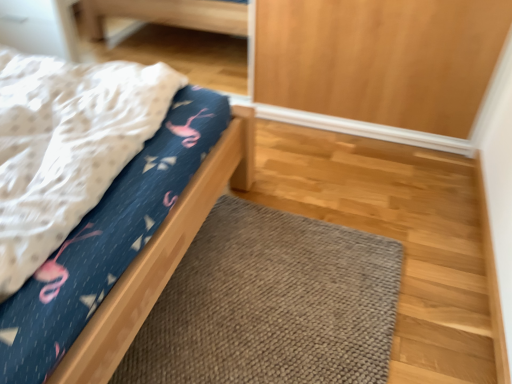
Where is `matte blue fabric bed at left`? The image size is (512, 384). matte blue fabric bed at left is located at coordinates (100, 206).

Describe the element at coordinates (100, 206) in the screenshot. I see `matte blue fabric bed at left` at that location.

Measure the distance between point (85, 336) and camera.

37.36 inches.

What is the approximate height of brown knitted doormat at lower center?

It is 1.65 inches.

This screenshot has width=512, height=384. What do you see at coordinates (271, 304) in the screenshot?
I see `brown knitted doormat at lower center` at bounding box center [271, 304].

The height and width of the screenshot is (384, 512). Find the location of `brown knitted doormat at lower center`. brown knitted doormat at lower center is located at coordinates (271, 304).

This screenshot has width=512, height=384. What are the coordinates of `matte blue fabric bed at left` in the screenshot? It's located at (100, 206).

Visually, is matte blue fabric bed at left positioned to the left or to the right of brown knitted doormat at lower center?

In the image, matte blue fabric bed at left appears on the left side of brown knitted doormat at lower center.

Relative to brown knitted doormat at lower center, is matte blue fabric bed at left in front or behind?

Clearly, matte blue fabric bed at left is in front of brown knitted doormat at lower center.

Considering the points (165, 72) and (324, 246), which point is in front, point (165, 72) or point (324, 246)?

Positioned in front is point (165, 72).

From the image's perspective, between matte blue fabric bed at left and brown knitted doormat at lower center, which one is located above?

From the image's view, matte blue fabric bed at left is above.

From a real-world perspective, between matte blue fabric bed at left and brown knitted doormat at lower center, who is vertically higher?

matte blue fabric bed at left, from a real-world perspective.

Which of these two, matte blue fabric bed at left or brown knitted doormat at lower center, is thinner?

With smaller width is brown knitted doormat at lower center.

Considering the sizes of objects matte blue fabric bed at left and brown knitted doormat at lower center in the image provided, who is taller, matte blue fabric bed at left or brown knitted doormat at lower center?

Standing taller between the two is matte blue fabric bed at left.

Considering the sizes of objects matte blue fabric bed at left and brown knitted doormat at lower center in the image provided, who is bigger, matte blue fabric bed at left or brown knitted doormat at lower center?

matte blue fabric bed at left.

Is brown knitted doormat at lower center completely or partially inside matte blue fabric bed at left?

No, brown knitted doormat at lower center is not surrounded by matte blue fabric bed at left.

Is matte blue fabric bed at left not near brown knitted doormat at lower center?

No, matte blue fabric bed at left is not far from brown knitted doormat at lower center.

Based on the photo, is matte blue fabric bed at left looking in the opposite direction of brown knitted doormat at lower center?

No, matte blue fabric bed at left's orientation is not away from brown knitted doormat at lower center.

Can you tell me how much matte blue fabric bed at left and brown knitted doormat at lower center differ in facing direction?

85.8 degrees.

How far apart are matte blue fabric bed at left and brown knitted doormat at lower center?

matte blue fabric bed at left is 18.18 inches away from brown knitted doormat at lower center.

Locate an element on the screen. The height and width of the screenshot is (384, 512). doormat that appears on the right of matte blue fabric bed at left is located at coordinates (271, 304).

Would you say brown knitted doormat at lower center is to the left or to the right of matte blue fabric bed at left in the picture?

Clearly, brown knitted doormat at lower center is on the right of matte blue fabric bed at left in the image.

Looking at this image, considering their positions, is brown knitted doormat at lower center located in front of or behind matte blue fabric bed at left?

brown knitted doormat at lower center is behind matte blue fabric bed at left.

Considering the positions of point (326, 252) and point (110, 346), is point (326, 252) closer or farther from the camera than point (110, 346)?

Point (326, 252) is farther from the camera than point (110, 346).

From the image's perspective, is brown knitted doormat at lower center positioned above or below matte blue fabric bed at left?

Clearly, from the image's perspective, brown knitted doormat at lower center is below matte blue fabric bed at left.

From a real-world perspective, which object stands above the other?

matte blue fabric bed at left is physically above.

Can you confirm if brown knitted doormat at lower center is wider than matte blue fabric bed at left?

No.

Does brown knitted doormat at lower center have a lesser height compared to matte blue fabric bed at left?

Correct, brown knitted doormat at lower center is not as tall as matte blue fabric bed at left.

Is brown knitted doormat at lower center smaller than matte blue fabric bed at left?

Yes.

Would you say brown knitted doormat at lower center is outside matte blue fabric bed at left?

brown knitted doormat at lower center is positioned outside matte blue fabric bed at left.

Is brown knitted doormat at lower center not near matte blue fabric bed at left?

They are positioned close to each other.

Looking at this image, is brown knitted doormat at lower center looking in the opposite direction of matte blue fabric bed at left?

brown knitted doormat at lower center does not have its back to matte blue fabric bed at left.

Can you tell me how much brown knitted doormat at lower center and matte blue fabric bed at left differ in facing direction?

The angle between the facing direction of brown knitted doormat at lower center and the facing direction of matte blue fabric bed at left is 85.8 degrees.

Measure the distance between brown knitted doormat at lower center and matte blue fabric bed at left.

brown knitted doormat at lower center is 18.18 inches away from matte blue fabric bed at left.

The image size is (512, 384). In order to click on doormat below the matte blue fabric bed at left (from the image's perspective) in this screenshot , I will do `click(271, 304)`.

Find the location of `bed located above the brown knitted doormat at lower center (from the image's perspective)`. bed located above the brown knitted doormat at lower center (from the image's perspective) is located at coordinates (100, 206).

The image size is (512, 384). I want to click on bed above the brown knitted doormat at lower center (from a real-world perspective), so click(100, 206).